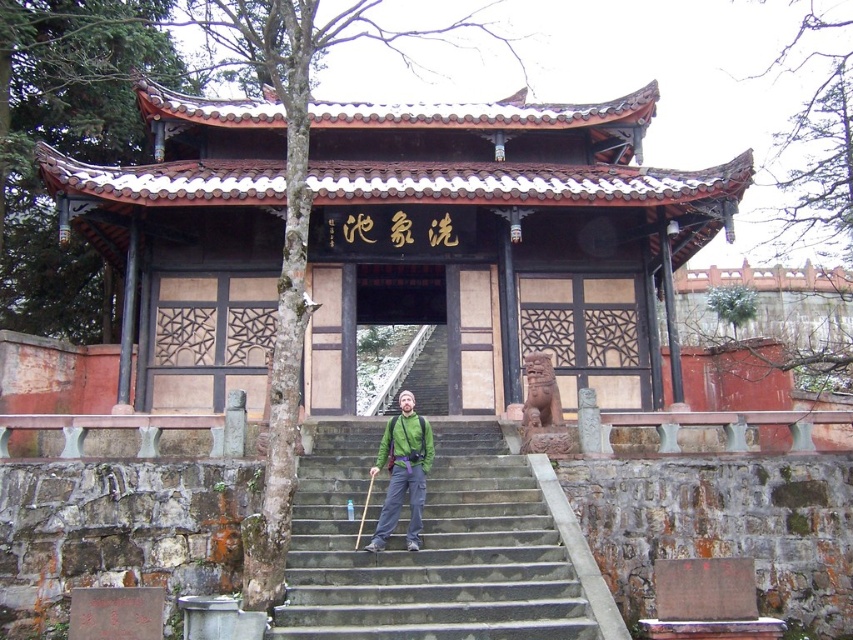
You are standing in front of the traditional Chinese pavilion and want to place your green fabric backpack at center on the gray stone stairs at center. Can you put it directly on the stairs?

The gray stone stairs at center is closer to the viewer than green fabric backpack at center, so the backpack is behind the stairs. Therefore, you can place the green fabric backpack at center directly on the gray stone stairs at center since the stairs are in front and accessible.

You are standing in front of the traditional Chinese pavilion and notice two points marked on the structure. The first point is at coordinates point (471, 481) and the second is at point (399, 448). Which of these two points is closer to your viewpoint?

Point (399, 448) is closer to your viewpoint because the Objects Description states that point (471, 481) is further to the camera than point (399, 448).